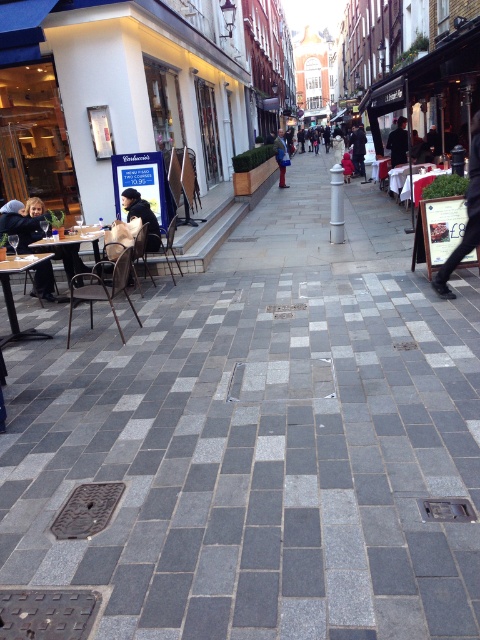
You are a delivery person standing at the entrance of the cafe on the left. You need to deliver a package to the person wearing the dark blue jeans at center. According to the coordinates provided, in which direction should you walk to reach them?

The dark blue jeans at center is located at coordinates point (468, 216). Since you are at the entrance of the cafe on the left, you should walk towards the center of the image to reach them.